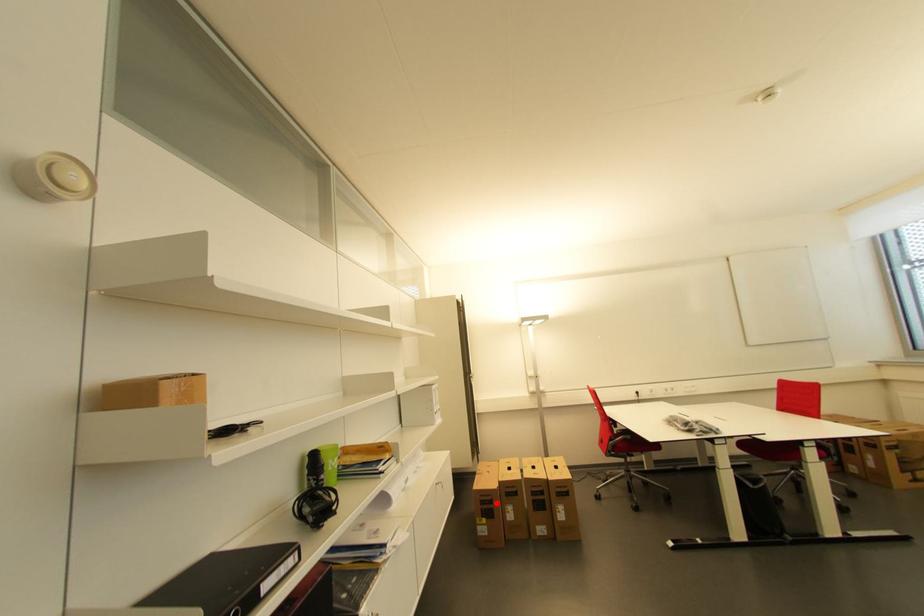
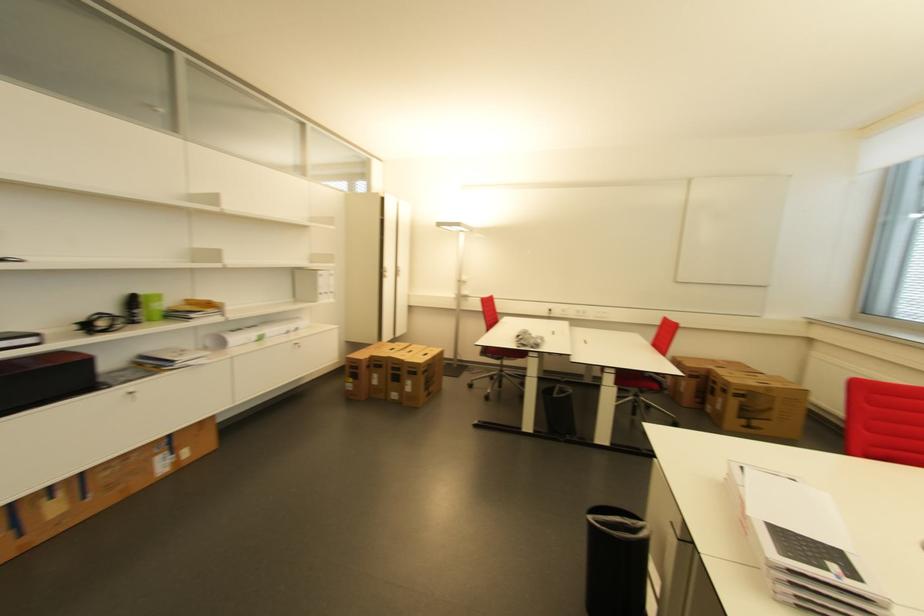
The point at the highlighted location is marked in the first image. Where is the corresponding point in the second image?

(362, 369)